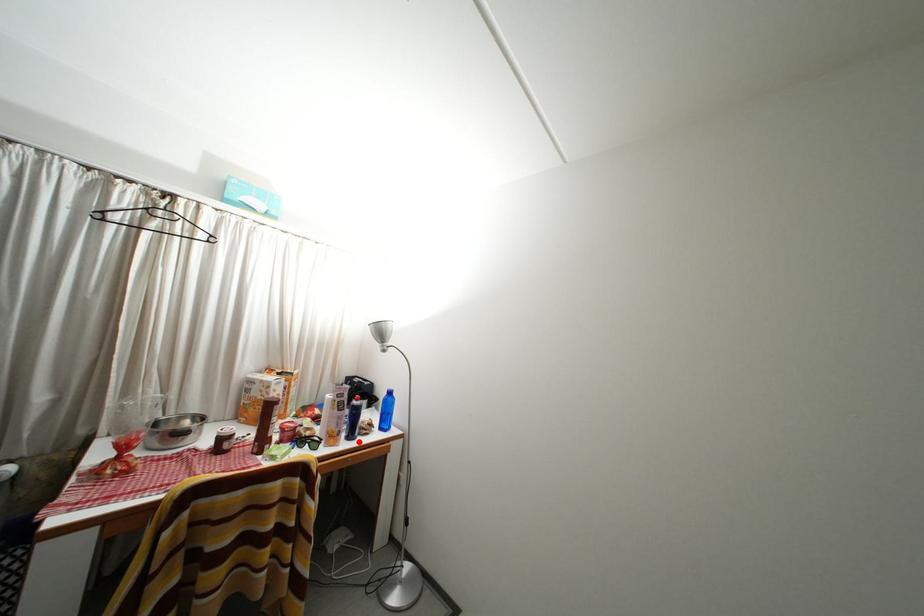
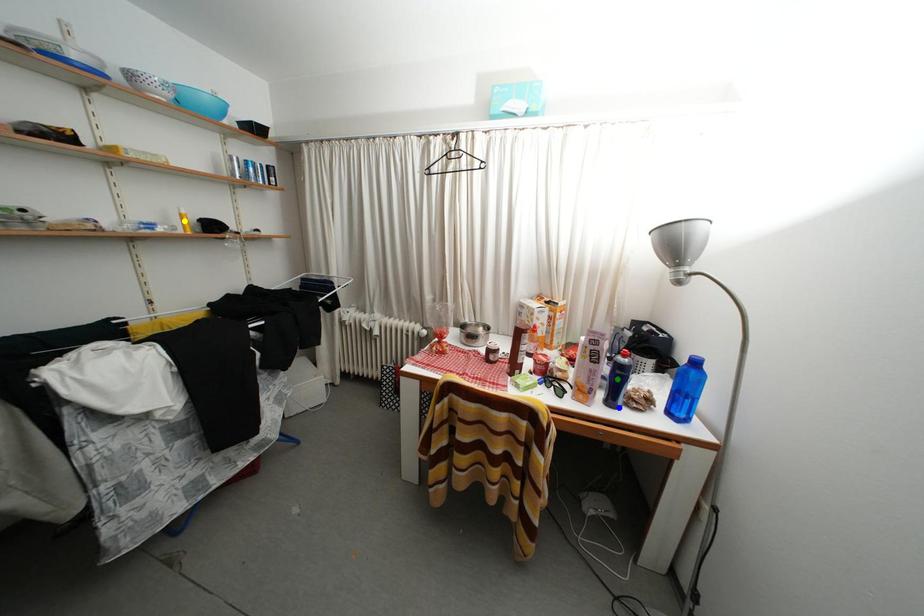
Question: I am providing you with two images of the same scene from different viewpoints. A red point is marked on the first image. You are given multiple points on the second image. Can you choose the point in image 2 that corresponds to the point in image 1?

Choices:
 (A) blue point
 (B) yellow point
 (C) green point

Answer: (A)